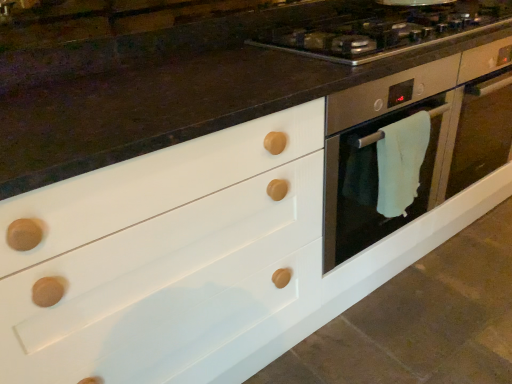
Question: From a real-world perspective, is satin silver oven at center right located beneath white towel at right?

Choices:
 (A) yes
 (B) no

Answer: (A)

Question: Is satin silver oven at center right outside of white towel at right?

Choices:
 (A) no
 (B) yes

Answer: (B)

Question: Does satin silver oven at center right have a smaller size compared to white towel at right?

Choices:
 (A) no
 (B) yes

Answer: (A)

Question: Can you confirm if satin silver oven at center right is wider than white towel at right?

Choices:
 (A) yes
 (B) no

Answer: (A)

Question: From the image's perspective, is satin silver oven at center right over white towel at right?

Choices:
 (A) no
 (B) yes

Answer: (B)

Question: From the image's perspective, is satin silver oven at center right beneath white towel at right?

Choices:
 (A) no
 (B) yes

Answer: (A)

Question: Is satin silver gas stove at upper center positioned behind satin silver oven at center right?

Choices:
 (A) no
 (B) yes

Answer: (A)

Question: Is satin silver gas stove at upper center to the right of satin silver oven at center right from the viewer's perspective?

Choices:
 (A) yes
 (B) no

Answer: (B)

Question: Is satin silver oven at center right a part of satin silver gas stove at upper center?

Choices:
 (A) yes
 (B) no

Answer: (B)

Question: From a real-world perspective, is satin silver gas stove at upper center on top of satin silver oven at center right?

Choices:
 (A) yes
 (B) no

Answer: (A)

Question: Is satin silver gas stove at upper center next to satin silver oven at center right and touching it?

Choices:
 (A) no
 (B) yes

Answer: (A)

Question: Is satin silver gas stove at upper center taller than satin silver oven at center right?

Choices:
 (A) no
 (B) yes

Answer: (A)

Question: From a real-world perspective, is satin silver gas stove at upper center physically below white towel at right?

Choices:
 (A) yes
 (B) no

Answer: (B)